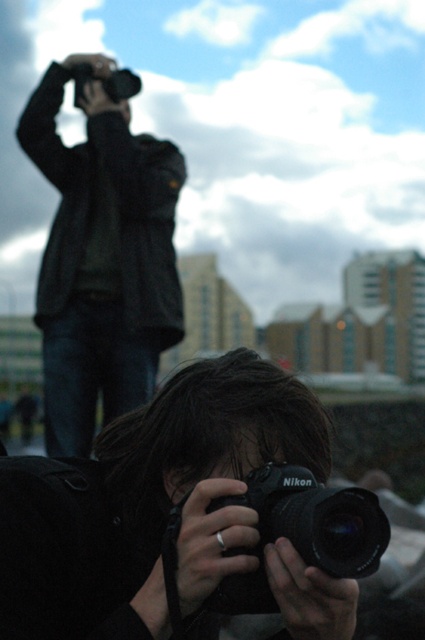
You are a photographer trying to set up a tripod between the dark gray jacket at upper left and the matte black camera at upper left. Can you place it in between them?

The dark gray jacket at upper left is closer to the viewer than the matte black camera at upper left, so you can place the tripod between them as they are at different depths.

In the scene shown: You are a photographer trying to decide where to place your new camera bag. You notice the dark gray jacket at upper left and the black matte nikon camera at center in the image. Which object is wider so you can place the bag next to it?

The dark gray jacket at upper left is wider than the black matte nikon camera at center, so you should place the bag next to the dark gray jacket at upper left.